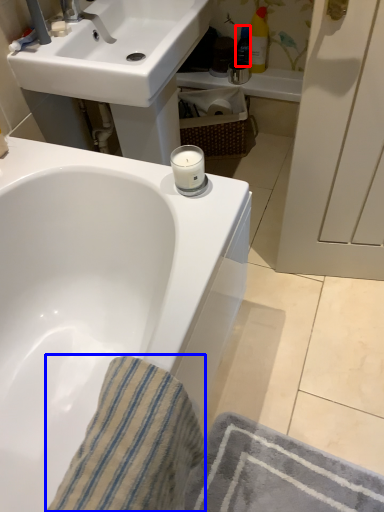
Question: Among these objects, which one is farthest to the camera, toiletry (highlighted by a red box) or bath towel (highlighted by a blue box)?

Choices:
 (A) toiletry
 (B) bath towel

Answer: (A)